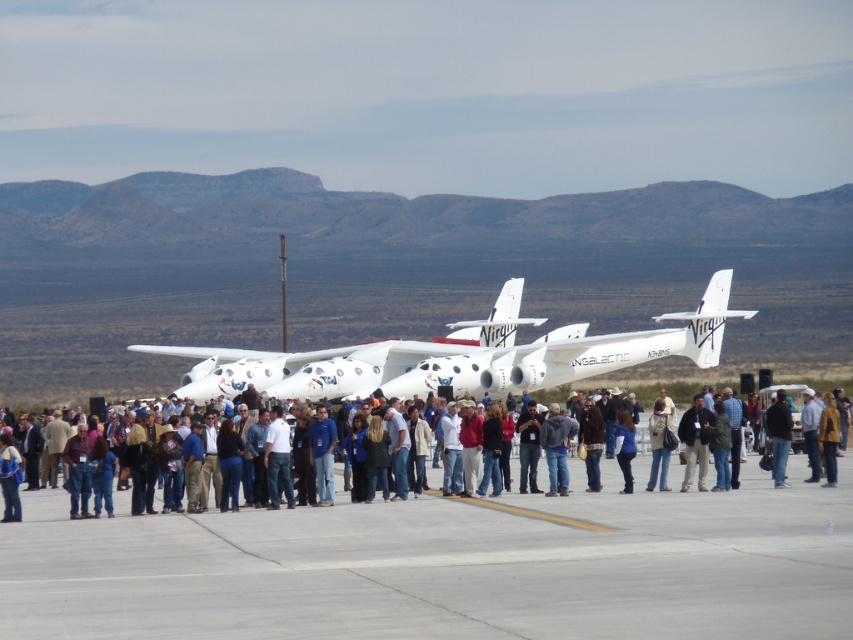
You are a photographer at the airfield. You want to take a photo of the white glossy airplane at center and the black leather jacket at center. Which object should you focus on first if you want to capture both in a single frame without moving the camera?

The white glossy airplane at center is wider than the black leather jacket at center. Since the airplane is wider, you should focus on the airplane first to ensure it fits within the frame, then adjust to include the jacket.

You are standing at the edge of the airfield and want to walk directly to the gray concrete tarmac at center. According to the coordinates provided, in which direction should you head?

The gray concrete tarmac at center is located at point 0.886 on the x and 0.524 on the y coordinate. Since you are at the edge, you should head towards the center of the airfield where the coordinates indicate the tarmac is positioned.